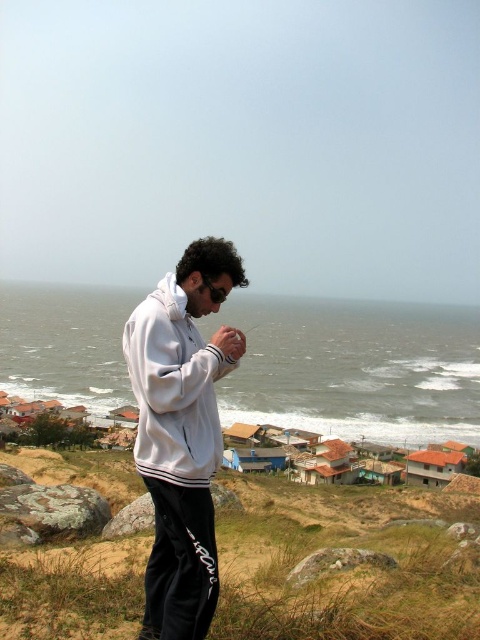
Question: Which object is farther from the camera taking this photo?

Choices:
 (A) white matte jacket at center
 (B) matte white hand at center

Answer: (B)

Question: Is white matte jacket at center to the left of white fleece sweatshirt at center from the viewer's perspective?

Choices:
 (A) no
 (B) yes

Answer: (A)

Question: Does white matte jacket at center have a lesser width compared to white fleece sweatshirt at center?

Choices:
 (A) no
 (B) yes

Answer: (B)

Question: Which point is closer to the camera taking this photo?

Choices:
 (A) coord(218,426)
 (B) coord(223,344)

Answer: (A)

Question: Considering the real-world distances, which object is closest to the white matte jacket at center?

Choices:
 (A) matte white hand at center
 (B) white fleece sweatshirt at center

Answer: (B)

Question: Does white matte jacket at center appear over white fleece sweatshirt at center?

Choices:
 (A) no
 (B) yes

Answer: (B)